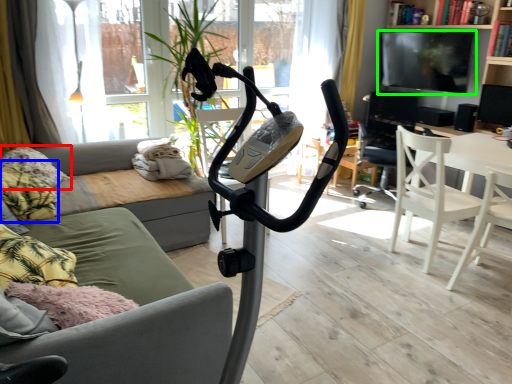
Question: Which object is positioned farthest from pillow (highlighted by a red box)? Select from pillow (highlighted by a blue box) and television (highlighted by a green box).

Choices:
 (A) pillow
 (B) television

Answer: (B)